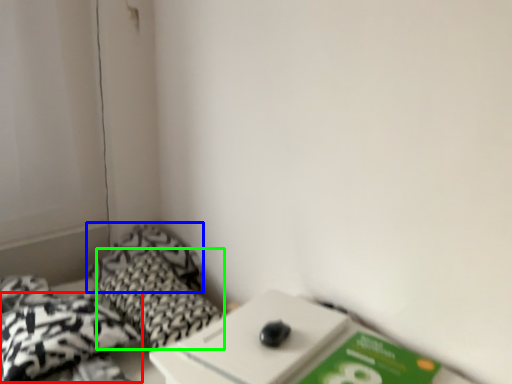
Question: Estimate the real-world distances between objects in this image. Which object is closer to throw pillow (highlighted by a red box), pillow (highlighted by a blue box) or pillow (highlighted by a green box)?

Choices:
 (A) pillow
 (B) pillow

Answer: (B)